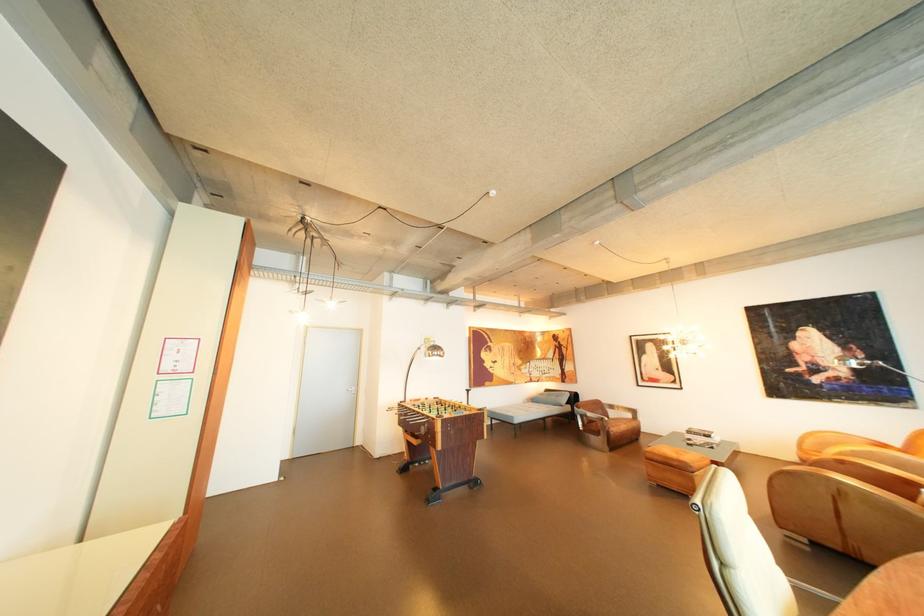
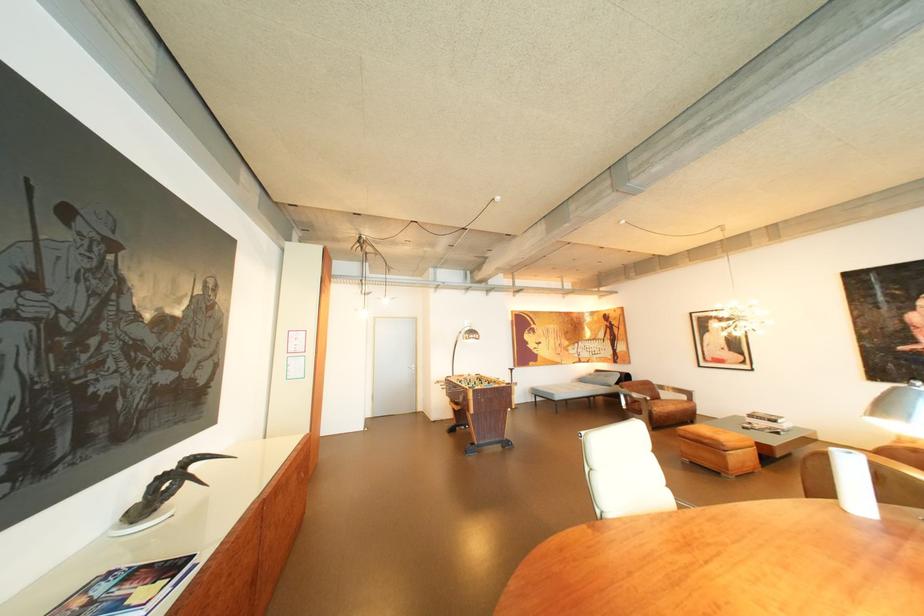
The images are taken continuously from a first-person perspective. In which direction are you moving?

The cameraman walked toward right, backward.